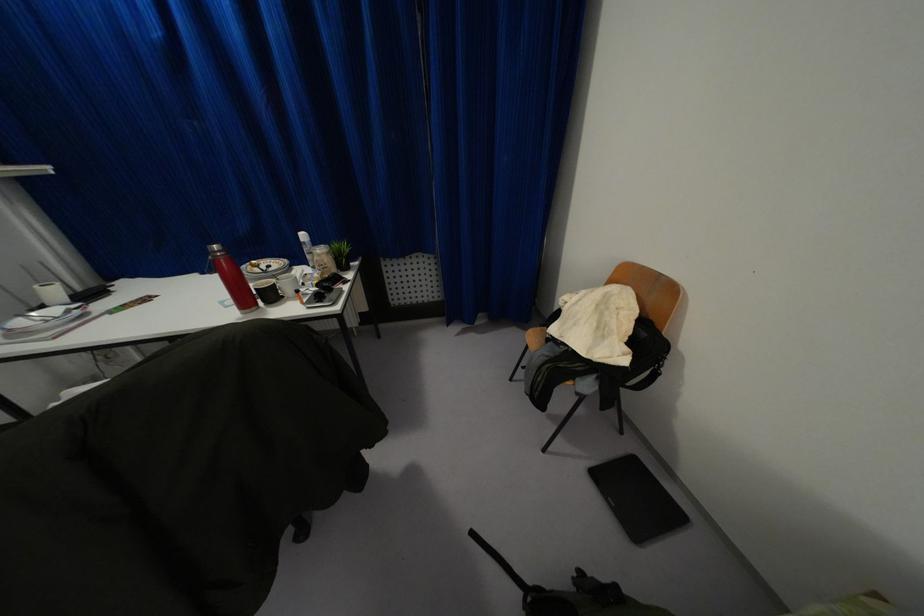
The image size is (924, 616). Find the location of `black tablet`. black tablet is located at coordinates (637, 499).